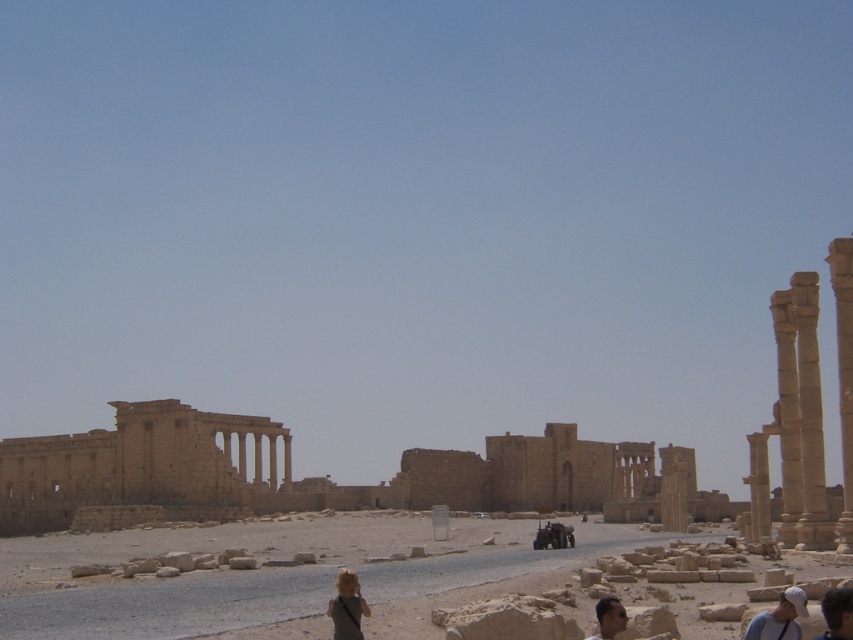
Question: Does light brown fabric backpack at lower center have a larger size compared to dark hair at lower right?

Choices:
 (A) yes
 (B) no

Answer: (A)

Question: Which of the following is the farthest from the observer?

Choices:
 (A) (187, 429)
 (B) (361, 637)

Answer: (A)

Question: Does light brown fabric backpack at lower center have a lesser width compared to dark brown hair at lower right?

Choices:
 (A) no
 (B) yes

Answer: (A)

Question: Considering the relative positions of light brown leather cap at lower right and light brown fabric backpack at lower center in the image provided, where is light brown leather cap at lower right located with respect to light brown fabric backpack at lower center?

Choices:
 (A) left
 (B) right

Answer: (B)

Question: Estimate the real-world distances between objects in this image. Which object is closer to the light brown fabric backpack at lower center?

Choices:
 (A) dark brown hair at lower right
 (B) beige stone ruins at left
 (C) light brown leather cap at lower right
 (D) dark hair at lower right

Answer: (A)

Question: Which of the following is the farthest from the observer?

Choices:
 (A) light brown leather cap at lower right
 (B) light brown fabric backpack at lower center
 (C) dark brown hair at lower right
 (D) dark hair at lower right

Answer: (B)